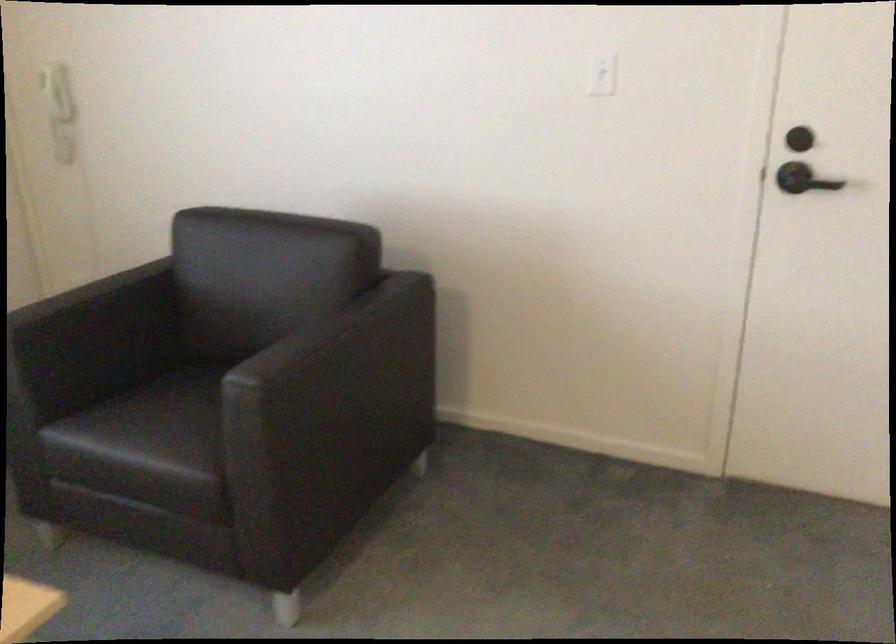
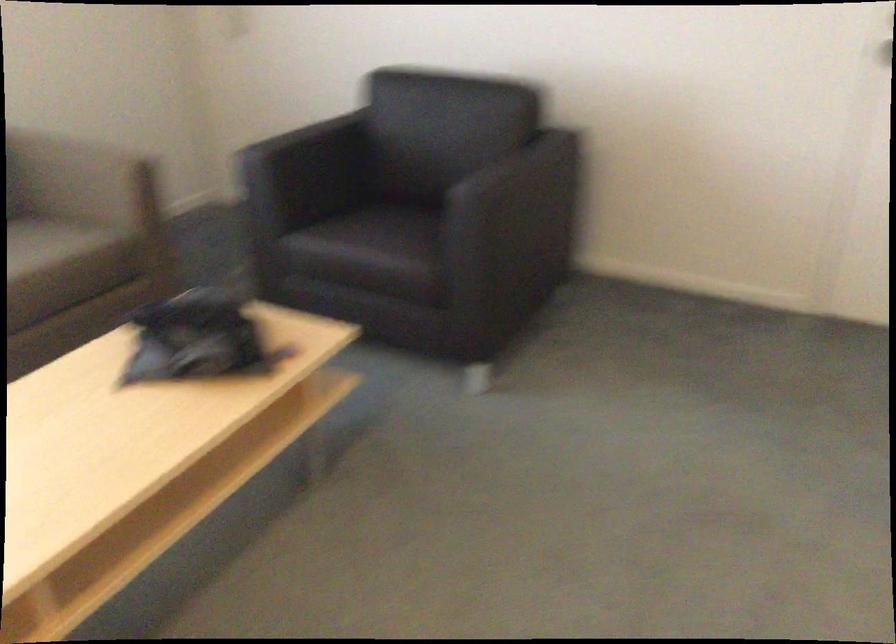
Question: Based on the continuous images, in which direction is the camera rotating? Reply with the corresponding letter.

Choices:
 (A) Left
 (B) Right
 (C) Up
 (D) Down

Answer: (D)